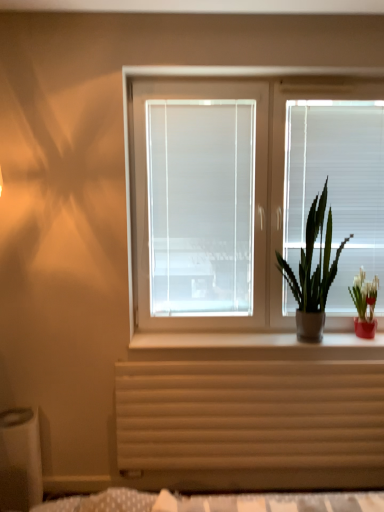
The image size is (384, 512). What do you see at coordinates (313, 272) in the screenshot?
I see `green matte plant at right, which is the first houseplant from left to right` at bounding box center [313, 272].

At what (x,y) coordinates should I click in order to perform the action: click on white matte window at center. Please return your answer as a coordinate pair (x, y). The width and height of the screenshot is (384, 512). Looking at the image, I should click on (255, 187).

Describe the element at coordinates (254, 346) in the screenshot. The image size is (384, 512). I see `white matte window sill at center` at that location.

Image resolution: width=384 pixels, height=512 pixels. Describe the element at coordinates (364, 304) in the screenshot. I see `green leafy plant at right, arranged as the 1th houseplant when viewed from the right` at that location.

The width and height of the screenshot is (384, 512). What are the coordinates of `green leafy plant at right, marked as the 2th houseplant in a left-to-right arrangement` in the screenshot? It's located at (364, 304).

Find the location of `green matte plant at right, the second houseplant in the right-to-left sequence`. green matte plant at right, the second houseplant in the right-to-left sequence is located at coordinates (313, 272).

Is green matte plant at right, which is the first houseplant from left to right, at the back of white matte window box at lower left?

No, green matte plant at right, which is the first houseplant from left to right, is not at the back of white matte window box at lower left.

Which of these two, white matte window box at lower left or green matte plant at right, which is the first houseplant from left to right, is smaller?

white matte window box at lower left is smaller.

Which object is positioned more to the right, white matte window box at lower left or green matte plant at right, the second houseplant in the right-to-left sequence?

From the viewer's perspective, green matte plant at right, the second houseplant in the right-to-left sequence, appears more on the right side.

At what (x,y) coordinates should I click in order to perform the action: click on window in front of the white matte blind at right. Please return your answer as a coordinate pair (x, y). The width and height of the screenshot is (384, 512). Looking at the image, I should click on 255,187.

Would you say white matte blind at right is to the left or to the right of white matte window at center in the picture?

white matte blind at right is positioned on white matte window at center's right side.

Is white matte blind at right oriented towards white matte window at center?

Yes, white matte blind at right is turned towards white matte window at center.

Considering the sizes of objects white matte blind at right and white matte window at center in the image provided, who is bigger, white matte blind at right or white matte window at center?

white matte window at center is bigger.

From a real-world perspective, who is located lower, white matte window sill at center or green matte plant at right, which is the first houseplant from left to right?

In real-world perspective, white matte window sill at center is lower.

Can you tell me how much white matte window sill at center and green matte plant at right, which is the first houseplant from left to right, differ in facing direction?

The angular difference between white matte window sill at center and green matte plant at right, which is the first houseplant from left to right, is 0.000815 degrees.

Is white matte window sill at center next to green matte plant at right, the second houseplant in the right-to-left sequence?

No, white matte window sill at center is not beside green matte plant at right, the second houseplant in the right-to-left sequence.

How distant is white matte blind at right from green matte plant at right, the second houseplant in the right-to-left sequence?

white matte blind at right and green matte plant at right, the second houseplant in the right-to-left sequence, are 6.28 inches apart.

The height and width of the screenshot is (512, 384). In order to click on blind behind the green matte plant at right, which is the first houseplant from left to right in this screenshot , I will do `click(337, 187)`.

Based on the photo, can you tell me how much white matte blind at right and green matte plant at right, the second houseplant in the right-to-left sequence, differ in facing direction?

0.00108 degrees separate the facing orientations of white matte blind at right and green matte plant at right, the second houseplant in the right-to-left sequence.

Is white matte blind at right facing away from green matte plant at right, the second houseplant in the right-to-left sequence?

Correct, white matte blind at right is looking away from green matte plant at right, the second houseplant in the right-to-left sequence.

Is white matte window screen at center situated inside white matte window box at lower left or outside?

white matte window screen at center is spatially situated outside white matte window box at lower left.

From the image's perspective, which object appears higher, white matte window screen at center or white matte window box at lower left?

From the image's view, white matte window screen at center is above.

Locate an element on the screen. houseplant that is the 2nd object directly below the white matte window at center (from a real-world perspective) is located at coordinates (364, 304).

How many degrees apart are the facing directions of white matte window at center and green leafy plant at right, marked as the 2th houseplant in a left-to-right arrangement?

white matte window at center and green leafy plant at right, marked as the 2th houseplant in a left-to-right arrangement, are facing 0.000628 degrees away from each other.

In the scene shown: Could green leafy plant at right, marked as the 2th houseplant in a left-to-right arrangement, be considered to be inside white matte window at center?

Yes, green leafy plant at right, marked as the 2th houseplant in a left-to-right arrangement, can be found within white matte window at center.

Does white matte window at center lie in front of green leafy plant at right, arranged as the 1th houseplant when viewed from the right?

Yes, it is in front of green leafy plant at right, arranged as the 1th houseplant when viewed from the right.

Does white matte window sill at center turn towards green leafy plant at right, marked as the 2th houseplant in a left-to-right arrangement?

No, white matte window sill at center is not turned towards green leafy plant at right, marked as the 2th houseplant in a left-to-right arrangement.

Between point (164, 343) and point (361, 274), which one is positioned behind?

The point (361, 274) is behind.

Is white matte window sill at center positioned beyond the bounds of green leafy plant at right, marked as the 2th houseplant in a left-to-right arrangement?

That's correct, white matte window sill at center is outside of green leafy plant at right, marked as the 2th houseplant in a left-to-right arrangement.

The width and height of the screenshot is (384, 512). In order to click on the 1st houseplant behind the white matte window box at lower left, starting your count from the anchor in this screenshot , I will do `click(313, 272)`.

Locate an element on the screen. This screenshot has width=384, height=512. blind above the white matte window at center (from the image's perspective) is located at coordinates pos(337,187).

Considering their positions, is white matte window box at lower left positioned closer to green leafy plant at right, marked as the 2th houseplant in a left-to-right arrangement, than white matte window screen at center?

white matte window screen at center is positioned closer to the anchor green leafy plant at right, marked as the 2th houseplant in a left-to-right arrangement.

Looking at the image, which one is located further to green leafy plant at right, marked as the 2th houseplant in a left-to-right arrangement, white matte window box at lower left or white matte window sill at center?

white matte window box at lower left is positioned further to the anchor green leafy plant at right, marked as the 2th houseplant in a left-to-right arrangement.

Looking at the image, which one is located further to white matte blind at right, green leafy plant at right, arranged as the 1th houseplant when viewed from the right, or wooden radiator at lower center?

The object further to white matte blind at right is wooden radiator at lower center.

Estimate the real-world distances between objects in this image. Which object is further from white matte blind at right, green leafy plant at right, arranged as the 1th houseplant when viewed from the right, or white matte window at center?

Based on the image, green leafy plant at right, arranged as the 1th houseplant when viewed from the right, appears to be further to white matte blind at right.

From the image, which object appears to be nearer to wooden radiator at lower center, white matte window screen at center or green leafy plant at right, marked as the 2th houseplant in a left-to-right arrangement?

green leafy plant at right, marked as the 2th houseplant in a left-to-right arrangement.

From the image, which object appears to be nearer to green matte plant at right, the second houseplant in the right-to-left sequence, white matte window sill at center or white matte blind at right?

white matte blind at right is closer to green matte plant at right, the second houseplant in the right-to-left sequence.

Which object lies nearer to the anchor point green matte plant at right, which is the first houseplant from left to right, white matte window sill at center or wooden radiator at lower center?

white matte window sill at center is closer to green matte plant at right, which is the first houseplant from left to right.

From the image, which object appears to be farther from white matte blind at right, white matte window screen at center or green leafy plant at right, arranged as the 1th houseplant when viewed from the right?

white matte window screen at center is further to white matte blind at right.

You are a GUI agent. You are given a task and a screenshot of the screen. Output one action in this format:
    pyautogui.click(x=<x>, y=<y>)
    Task: Click on the window screen between white matte window at center and white matte window box at lower left vertically
    
    Given the screenshot: What is the action you would take?
    pyautogui.click(x=201, y=206)

In order to click on radiator that lies between white matte window screen at center and white matte window box at lower left from top to bottom in this screenshot , I will do `click(248, 415)`.

The image size is (384, 512). I want to click on window sill between white matte window box at lower left and white matte window at center, so click(254, 346).

Find the location of a particular element. window sill situated between wooden radiator at lower center and green leafy plant at right, arranged as the 1th houseplant when viewed from the right, from left to right is located at coordinates (254, 346).